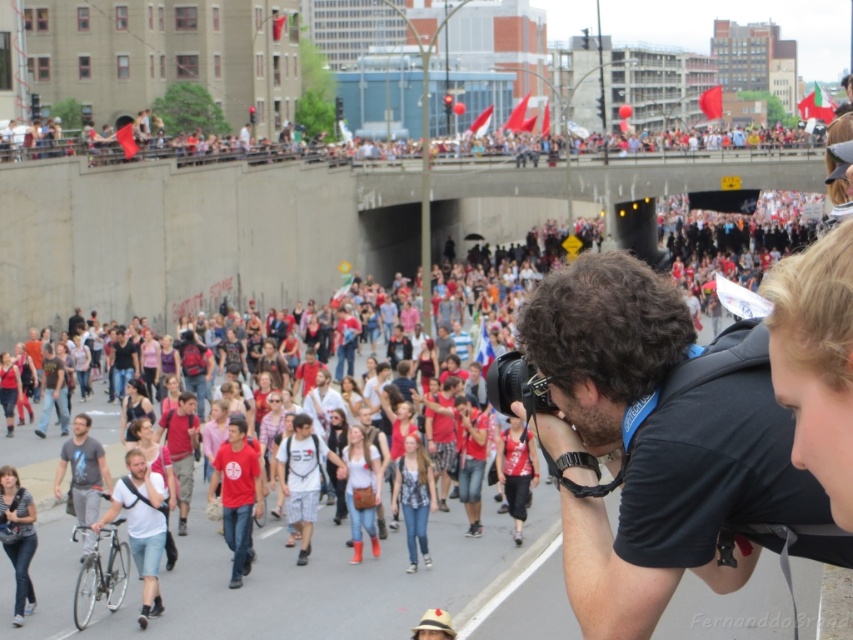
Question: Can you confirm if black fabric camera at center is bigger than gray cotton t-shirt at center?

Choices:
 (A) yes
 (B) no

Answer: (A)

Question: Can you confirm if matte red shirts at upper center is bigger than gray cotton t-shirt at center?

Choices:
 (A) no
 (B) yes

Answer: (B)

Question: From the image, what is the correct spatial relationship of black fabric camera at center in relation to gray cotton t-shirt at center?

Choices:
 (A) below
 (B) above

Answer: (B)

Question: Estimate the real-world distances between objects in this image. Which object is farther from the matte red shirts at upper center?

Choices:
 (A) gray cotton t-shirt at center
 (B) black fabric camera at center

Answer: (B)

Question: Among these objects, which one is farthest from the camera?

Choices:
 (A) matte red shirts at upper center
 (B) black fabric camera at center

Answer: (A)

Question: Estimate the real-world distances between objects in this image. Which object is farther from the gray cotton t-shirt at center?

Choices:
 (A) black fabric camera at center
 (B) matte red shirts at upper center

Answer: (B)